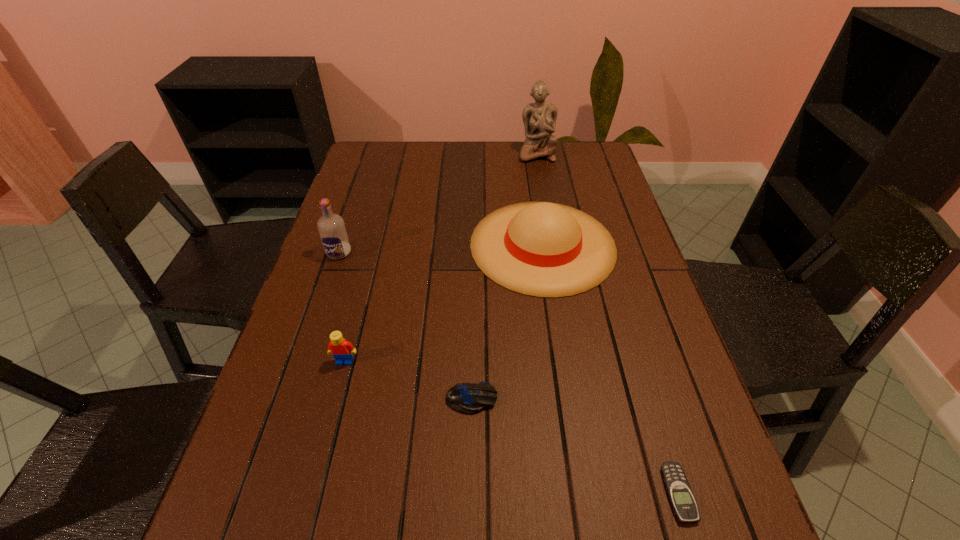
This screenshot has width=960, height=540. Identify the location of sombrero present at the right edge. (543, 249).

This screenshot has height=540, width=960. In order to click on beeper that is positioned at the right edge in this screenshot , I will do `click(679, 492)`.

This screenshot has height=540, width=960. I want to click on free space at the left edge, so click(x=277, y=464).

This screenshot has height=540, width=960. I want to click on vacant space at the right edge of the desktop, so click(x=646, y=281).

In the image, there is a desktop. Where is `vacant space at the far left corner`? Image resolution: width=960 pixels, height=540 pixels. vacant space at the far left corner is located at coordinates (361, 155).

The image size is (960, 540). I want to click on vacant point located between the second shortest object and the Lego, so tap(408, 380).

This screenshot has height=540, width=960. I want to click on free space between the beeper and the computer mouse, so click(x=575, y=446).

The width and height of the screenshot is (960, 540). I want to click on empty space that is in between the fourth tallest object and the tallest object, so click(441, 258).

Where is `free space between the leftmost object and the second object from left to right`? The image size is (960, 540). free space between the leftmost object and the second object from left to right is located at coordinates 342,307.

Where is `free spot between the third tallest object and the figurine`? The image size is (960, 540). free spot between the third tallest object and the figurine is located at coordinates (540, 199).